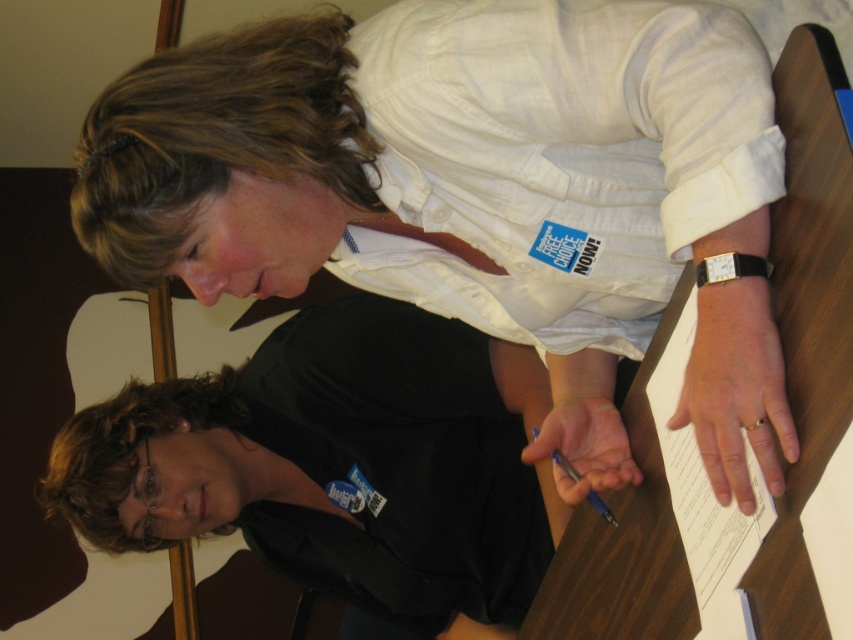
You are an observer looking at the scene. There is a black matte shirt at center and a blue metallic pen at lower center. Which object is located to the left of the other?

The black matte shirt at center is positioned on the left side of blue metallic pen at lower center.

You are designing a new seating arrangement for a meeting room and need to ensure that the chairs can accommodate the widest person in the scene. According to the scene description, which of the following statements is true about the widths of the white cotton shirt at upper center and the black matte shirt at center?

The white cotton shirt at upper center has a smaller width than the black matte shirt at center, so the chairs should be designed to accommodate the width of the black matte shirt at center as it is the wider of the two.

You are a photographer taking a picture of the black matte shirt at center and the blue metallic pen at lower center. Which object will be more visible in your photo?

The black matte shirt at center will be more visible in the photo because the blue metallic pen at lower center is behind it, making it partially or fully obscured.